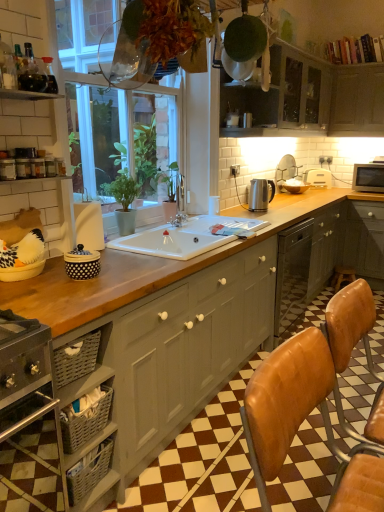
Where is `free spot in front of polka dot ceramic jar at left, placed as the first appliance when sorted from front to back`? free spot in front of polka dot ceramic jar at left, placed as the first appliance when sorted from front to back is located at coordinates (75, 287).